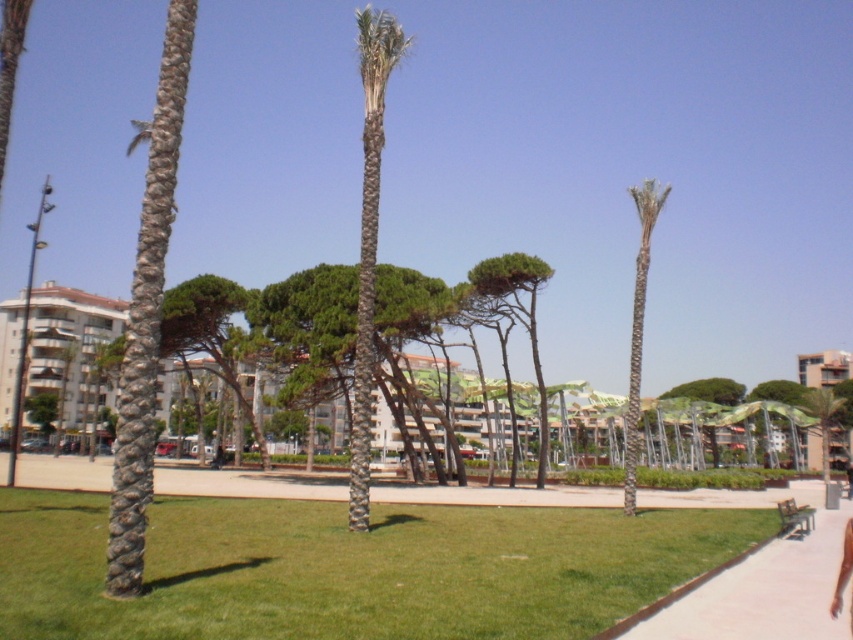
You are a gardener who needs to mow the green grass at center and trim the skinny tan skin at lower right. Which task should you do first if you want to tackle the taller vegetation first?

The skinny tan skin at lower right is taller than the green grass at center, so you should trim the skinny tan skin at lower right first.

You are a gardener planning to install a new bench in the park. You want to place it on the white concrete pavement at lower right but need to ensure there is enough space. Considering the size of the pavement and the nearby green textured palm tree at right, is the pavement wide enough to accommodate a standard bench?

The white concrete pavement at lower right has a lesser width compared to the green textured palm tree at right. Since the pavement is narrower, it may not have sufficient space for a standard bench unless the bench is positioned carefully to avoid encroaching on the palm tree area.

You are standing at the point with coordinates point [842,580] and want to walk towards the point with coordinates point [369,330]. Based on the park layout described, will you be walking towards the grassy area with palm trees or away from it?

Based on the description, point [369,330] is behind point [842,580]. Since the grassy area with palm trees is in the foreground, walking towards point [369,330] would mean moving away from the grassy area with palm trees and towards the mid or background elements like the pathway or buildings.